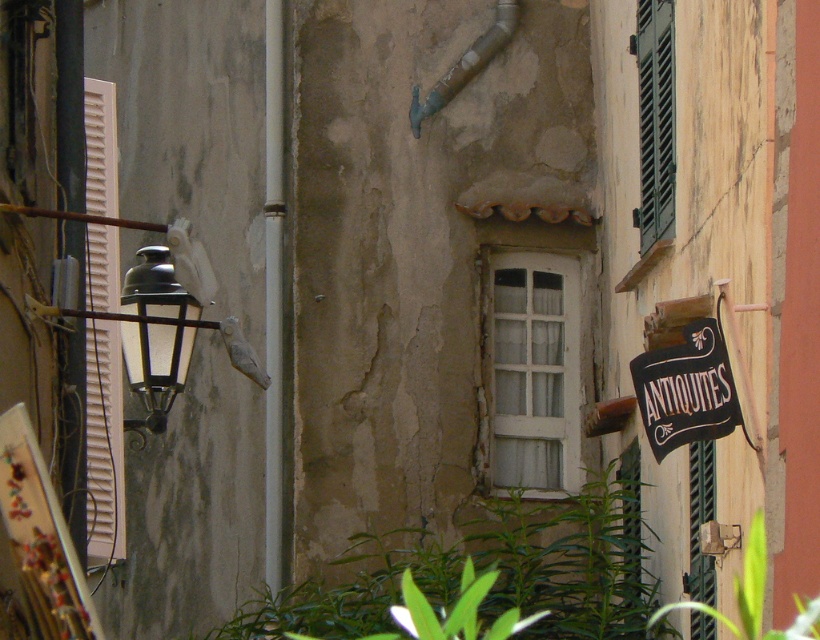
Measure the distance between white wooden shutters at left and camera.

A distance of 49.56 feet exists between white wooden shutters at left and camera.

How far apart are white wooden shutters at left and green wooden shutters at upper right?

white wooden shutters at left is 5.06 meters away from green wooden shutters at upper right.

The height and width of the screenshot is (640, 820). What do you see at coordinates (103, 442) in the screenshot? I see `white wooden shutters at left` at bounding box center [103, 442].

Identify the location of white wooden shutters at left. The width and height of the screenshot is (820, 640). (103, 442).

Is black fabric sign at right further to the viewer compared to matte black lantern at left?

That is False.

In the scene shown: Which is below, black fabric sign at right or matte black lantern at left?

black fabric sign at right is below.

Who is more distant from viewer, (695,422) or (175,372)?

Positioned behind is point (175,372).

Locate an element on the screen. The height and width of the screenshot is (640, 820). black fabric sign at right is located at coordinates (686, 388).

Can you confirm if black fabric sign at right is wider than green leafy plant at lower right?

Yes.

Looking at this image, can you confirm if black fabric sign at right is taller than green leafy plant at lower right?

Yes, black fabric sign at right is taller than green leafy plant at lower right.

Which is behind, point (727, 433) or point (697, 608)?

The point (697, 608) is more distant.

Image resolution: width=820 pixels, height=640 pixels. In order to click on black fabric sign at right in this screenshot , I will do tap(686, 388).